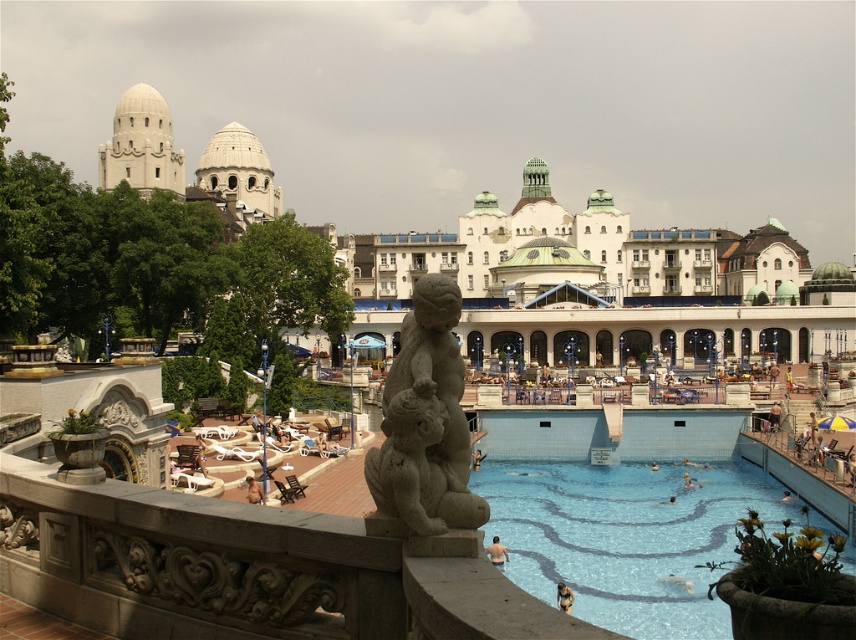
Can you confirm if blue tile swimming pool at lower right is positioned above gray stone sculpture at center?

No.

Who is positioned more to the right, blue tile swimming pool at lower right or gray stone sculpture at center?

Positioned to the right is blue tile swimming pool at lower right.

You are a GUI agent. You are given a task and a screenshot of the screen. Output one action in this format:
    pyautogui.click(x=<x>, y=<y>)
    Task: Click on the blue tile swimming pool at lower right
    
    Given the screenshot: What is the action you would take?
    pyautogui.click(x=628, y=536)

Find the location of a particular element. Image resolution: width=856 pixels, height=640 pixels. blue tile swimming pool at lower right is located at coordinates (628, 536).